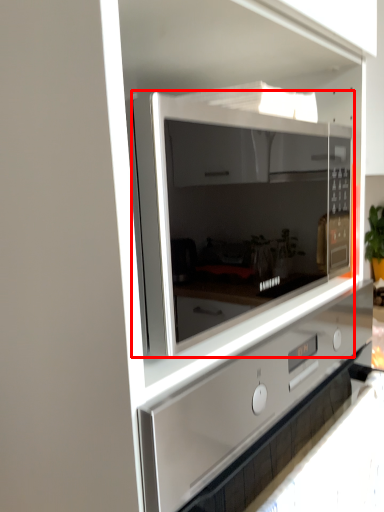
Question: Considering the relative positions of microwave oven (annotated by the red box) and home appliance in the image provided, where is microwave oven (annotated by the red box) located with respect to the staircase?

Choices:
 (A) left
 (B) right

Answer: (B)